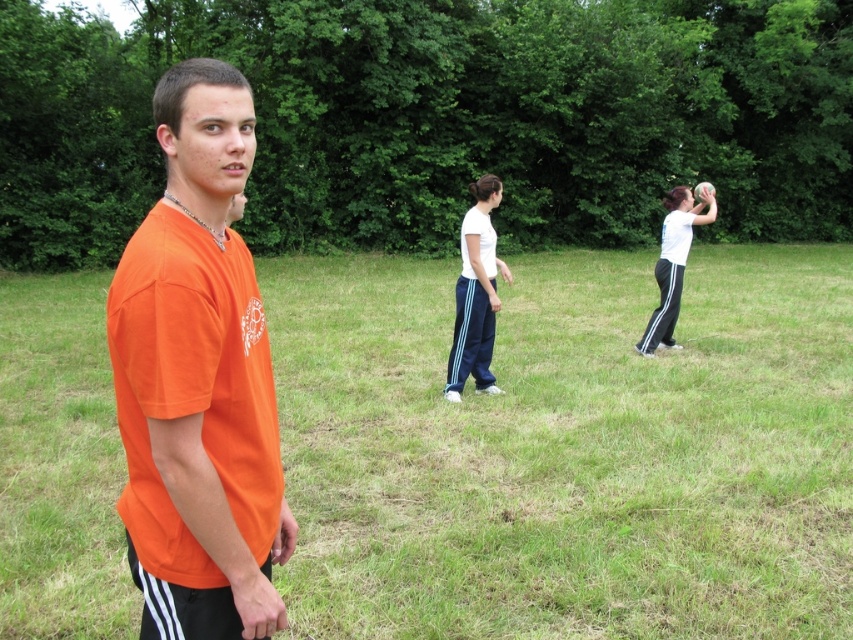
You are standing at the origin point in the image. What object is located at the coordinates point (567,449)?

The coordinates point (567,449) indicate green grass at center.